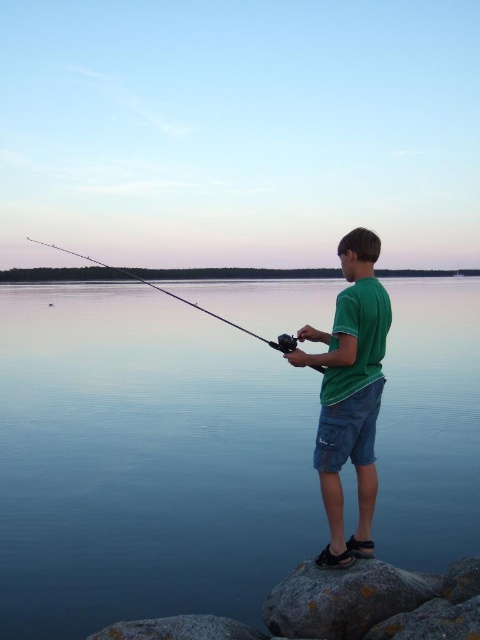
Who is positioned more to the right, transparent blue water at center or yellowish rock at lower center?

From the viewer's perspective, yellowish rock at lower center appears more on the right side.

Which is in front, point (145, 468) or point (339, 637)?

Point (339, 637) is more forward.

The height and width of the screenshot is (640, 480). Identify the location of transparent blue water at center. (144, 461).

Does yellowish rock at lower center have a smaller size compared to shiny metallic rod at center?

Yes, yellowish rock at lower center is smaller than shiny metallic rod at center.

This screenshot has height=640, width=480. Describe the element at coordinates (344, 598) in the screenshot. I see `yellowish rock at lower center` at that location.

Which is behind, point (298, 634) or point (168, 292)?

The point (168, 292) is behind.

Where is `yellowish rock at lower center`? The height and width of the screenshot is (640, 480). yellowish rock at lower center is located at coordinates (344, 598).

Does green cotton shirt at center have a lesser height compared to smooth gray rock at lower center?

No, green cotton shirt at center is not shorter than smooth gray rock at lower center.

At what (x,y) coordinates should I click in order to perform the action: click on green cotton shirt at center. Please return your answer as a coordinate pair (x, y). Looking at the image, I should click on (349, 392).